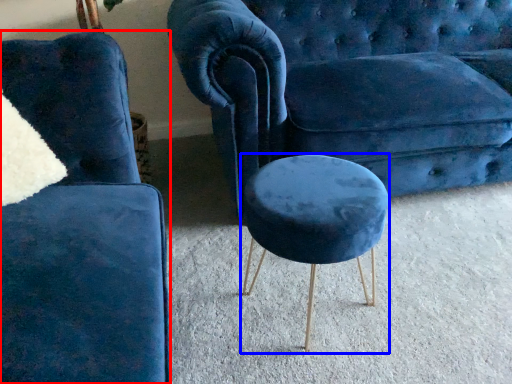
Question: Which object appears farthest to the camera in this image, chair (highlighted by a red box) or stool (highlighted by a blue box)?

Choices:
 (A) chair
 (B) stool

Answer: (B)